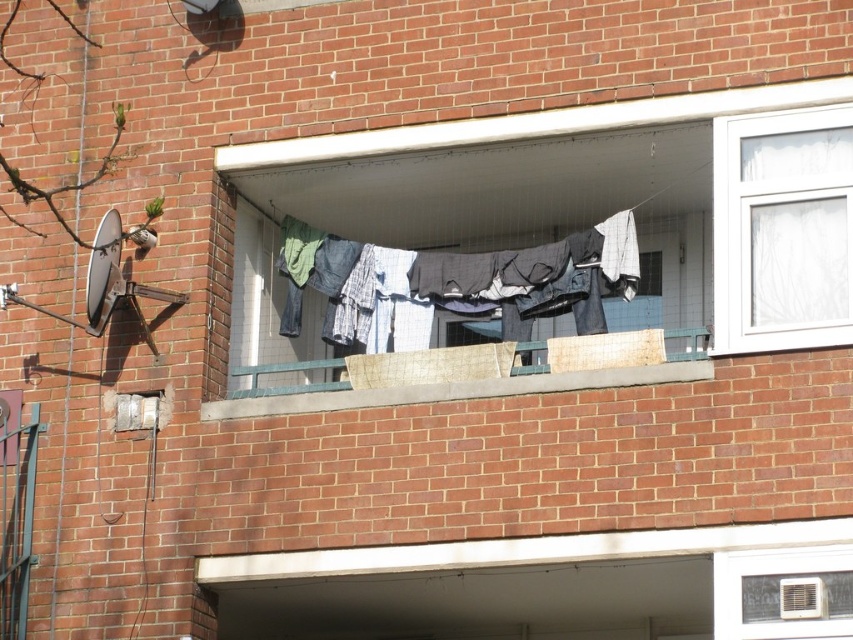
Can you confirm if white plastic window at upper right is positioned above blue cotton clothes at center?

Yes.

This screenshot has height=640, width=853. I want to click on white plastic window at upper right, so click(782, 230).

Does point (821, 195) come closer to viewer compared to point (422, 282)?

That is True.

This screenshot has width=853, height=640. Identify the location of white plastic window at upper right. (782, 230).

Can you confirm if white plastic window at upper right is positioned to the right of wooden planks at center?

Indeed, white plastic window at upper right is positioned on the right side of wooden planks at center.

How far apart are white plastic window at upper right and wooden planks at center?

3.04 meters

Locate an element on the screen. This screenshot has height=640, width=853. white plastic window at upper right is located at coordinates (782, 230).

The image size is (853, 640). I want to click on white plastic window at upper right, so pos(782,230).

Does blue cotton clothes at center have a larger size compared to wooden planks at center?

No, blue cotton clothes at center is not bigger than wooden planks at center.

The height and width of the screenshot is (640, 853). Find the location of `blue cotton clothes at center`. blue cotton clothes at center is located at coordinates (535, 275).